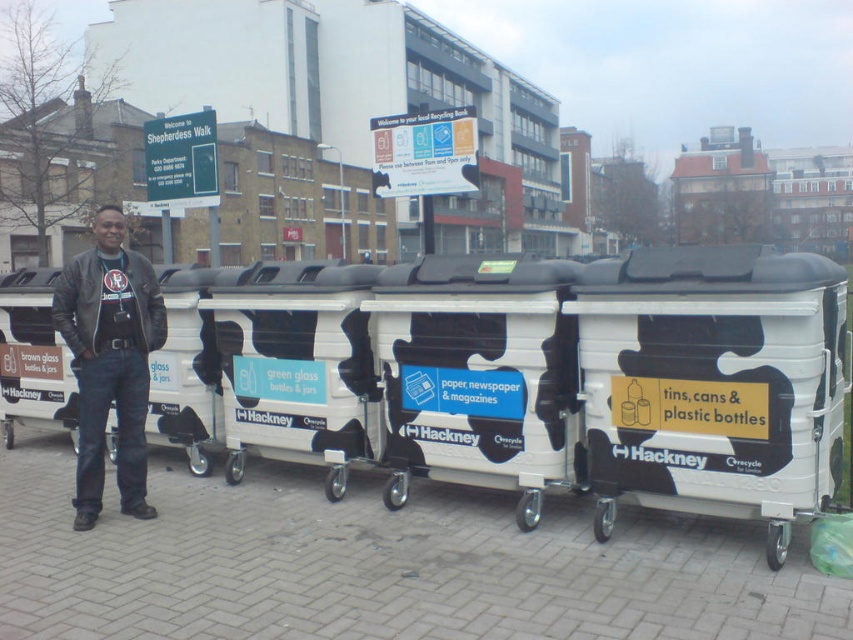
Question: Which object is farther from the camera taking this photo?

Choices:
 (A) white plastic recycling bin at center
 (B) white glossy recycling bin at center
 (C) green plastic sign at upper center
 (D) white paper sign at center

Answer: (C)

Question: Considering the relative positions of white matte recycling bin at right and white glossy recycling bin at center in the image provided, where is white matte recycling bin at right located with respect to white glossy recycling bin at center?

Choices:
 (A) right
 (B) left

Answer: (A)

Question: Which point appears farthest from the camera in this image?

Choices:
 (A) (218, 198)
 (B) (392, 124)
 (C) (306, 348)

Answer: (A)

Question: In this image, where is white matte recycling bin at right located relative to green plastic sign at upper center?

Choices:
 (A) above
 (B) below

Answer: (B)

Question: Does white glossy recycling bin at center appear under white plastic recycling bin at center?

Choices:
 (A) yes
 (B) no

Answer: (B)

Question: Which of the following is the farthest from the observer?

Choices:
 (A) green plastic sign at upper center
 (B) matte black jacket at center
 (C) white paper sign at center
 (D) white glossy recycling bin at center

Answer: (A)